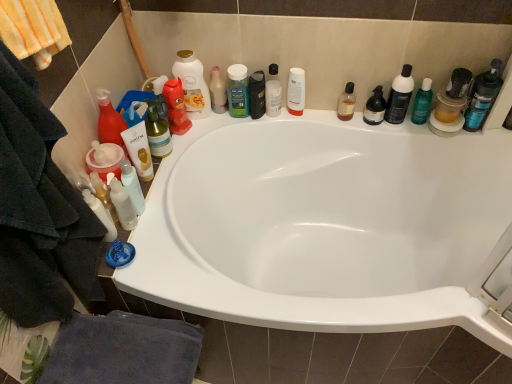
Locate an element on the screen. This screenshot has width=512, height=384. free point above dark blue towel at lower left (from a real-world perspective) is located at coordinates (118, 349).